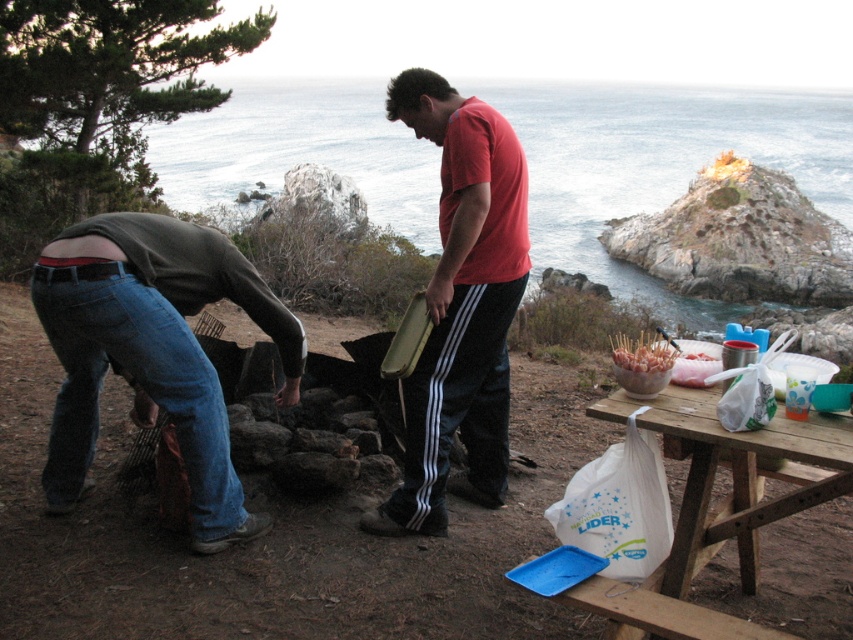
Looking at this image, you are a photographer trying to capture the scene by the sea. You want to focus on the denim jeans at lower left and the jeans at center. Which pair of jeans is covering part of the other?

Result: The denim jeans at lower left is positioned over the jeans at center, so the denim jeans at lower left is covering part of the jeans at center.

You are a photographer trying to capture the scene. You have a camera with a zoom lens. The denim jeans at lower left and jeans at center are both in your viewfinder. Since you want to focus on the smaller pair of jeans, which one should you zoom in on?

The jeans at center is smaller than denim jeans at lower left, so you should zoom in on the jeans at center to focus on the smaller pair.